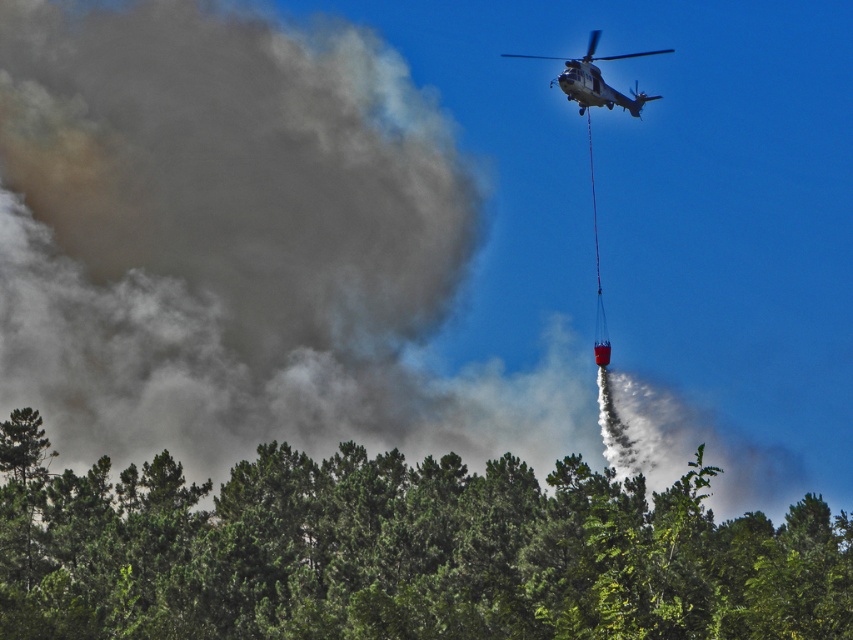
You are a pilot flying the metallic gray helicopter at upper center. You need to navigate around the green leafy trees at lower center to avoid collision. Based on your position, which direction should you adjust your flight path to maintain a safe distance?

The green leafy trees at lower center are closer to the viewer than the metallic gray helicopter at upper center, so the helicopter is further away. To avoid collision, the pilot should adjust the flight path upward to increase altitude and maintain a safe distance from the trees below.